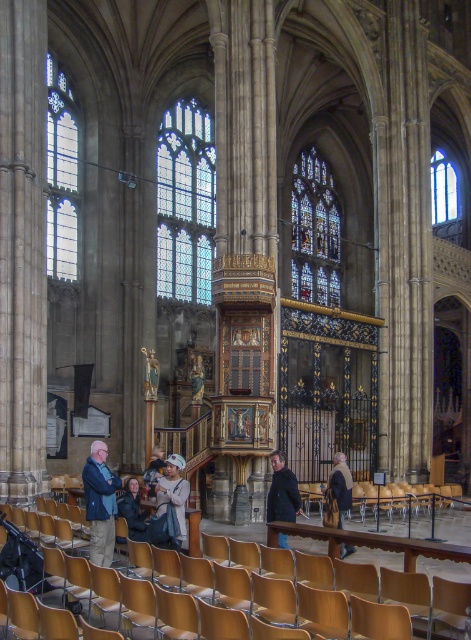
Question: Is light brown leather jacket at lower left above dark brown leather coat at center?

Choices:
 (A) no
 (B) yes

Answer: (B)

Question: Is wooden polished chair at center positioned before light brown leather jacket at lower left?

Choices:
 (A) no
 (B) yes

Answer: (B)

Question: Does dark brown leather coat at center have a lesser width compared to dark brown leather jacket at center?

Choices:
 (A) yes
 (B) no

Answer: (A)

Question: Estimate the real-world distances between objects in this image. Which object is farther from the wooden polished chair at center?

Choices:
 (A) dark brown leather jacket at center
 (B) light brown leather jacket at lower left
 (C) dark brown leather coat at center

Answer: (B)

Question: Estimate the real-world distances between objects in this image. Which object is farther from the dark brown leather jacket at center?

Choices:
 (A) dark brown leather coat at center
 (B) wooden polished chair at center
 (C) matte gray coat at lower center

Answer: (C)

Question: Which point is closer to the camera taking this photo?

Choices:
 (A) (286, 484)
 (B) (162, 484)
 (C) (451, 625)

Answer: (C)